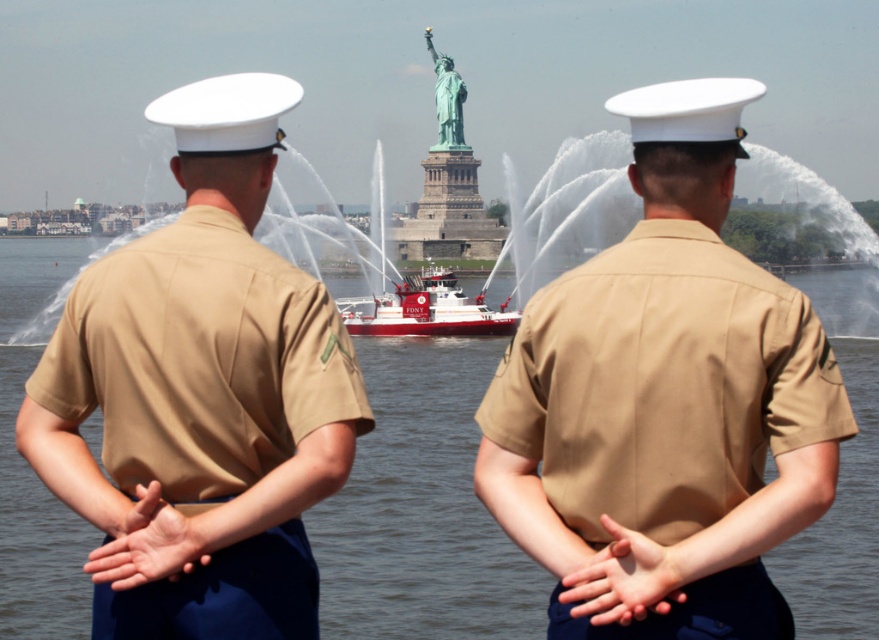
Does khaki uniform at center appear under green patina statue at center?

Correct, khaki uniform at center is located below green patina statue at center.

Image resolution: width=879 pixels, height=640 pixels. In order to click on khaki uniform at center in this screenshot , I will do `click(665, 403)`.

The image size is (879, 640). Find the location of `clear water at center`. clear water at center is located at coordinates (420, 508).

The width and height of the screenshot is (879, 640). I want to click on clear water at center, so click(420, 508).

Who is higher up, tan cotton shirt at center or green patina statue at center?

green patina statue at center is higher up.

Is the position of tan cotton shirt at center more distant than that of green patina statue at center?

That is False.

This screenshot has width=879, height=640. Describe the element at coordinates (200, 360) in the screenshot. I see `tan cotton shirt at center` at that location.

The image size is (879, 640). I want to click on tan cotton shirt at center, so click(200, 360).